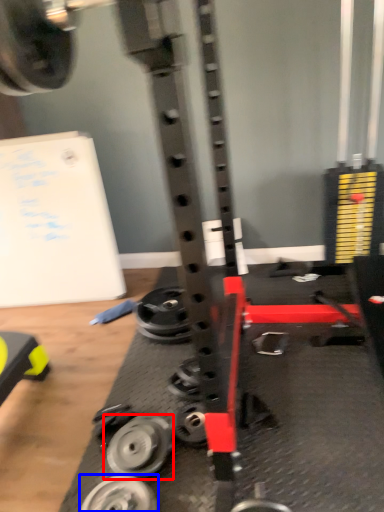
Question: Among these objects, which one is farthest to the camera, wheel (highlighted by a red box) or wheel (highlighted by a blue box)?

Choices:
 (A) wheel
 (B) wheel

Answer: (A)